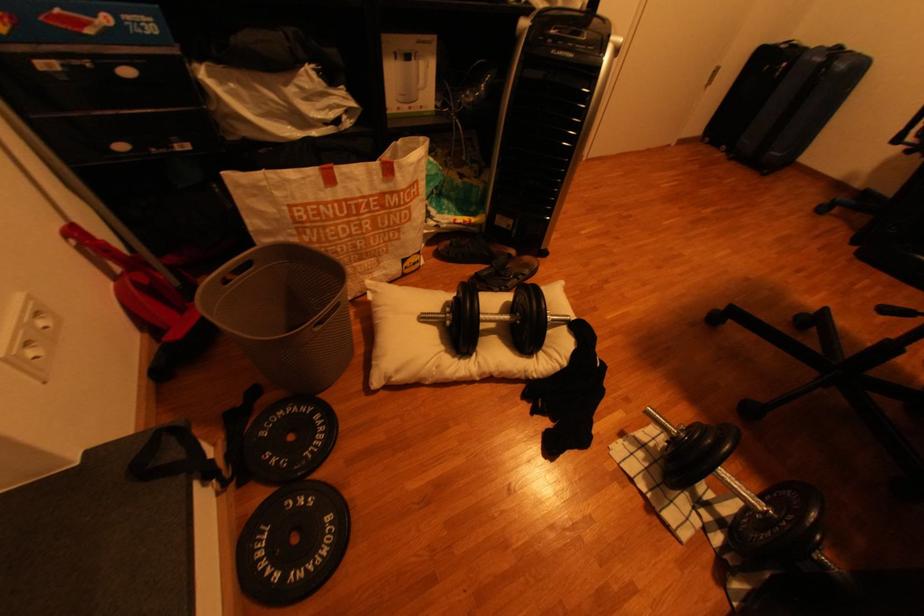
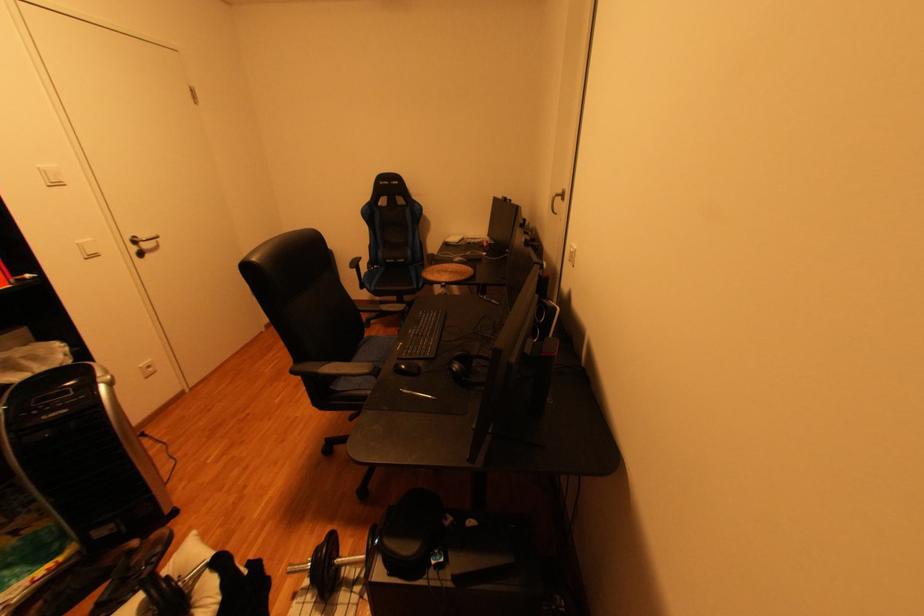
In the second image, find the point that corresponds to point 655,464 in the first image.

(323, 600)